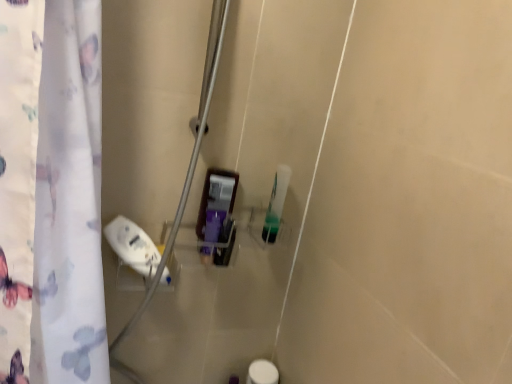
Question: Would you say translucent plastic container at center, the first toiletry viewed from the front, is to the left or to the right of green translucent bottle at center, the 2th toiletry from the left, in the picture?

Choices:
 (A) right
 (B) left

Answer: (B)

Question: From the image's perspective, is translucent plastic container at center, arranged as the 2th toiletry when viewed from the back, positioned above or below green translucent bottle at center, the 1th toiletry from the back?

Choices:
 (A) above
 (B) below

Answer: (B)

Question: In terms of width, does translucent plastic container at center, the first toiletry viewed from the front, look wider or thinner when compared to green translucent bottle at center, which is counted as the 1th toiletry, starting from the right?

Choices:
 (A) thin
 (B) wide

Answer: (B)

Question: Considering their positions, is green translucent bottle at center, which is counted as the 1th toiletry, starting from the right, located in front of or behind translucent plastic container at center, the 2th toiletry when ordered from right to left?

Choices:
 (A) behind
 (B) front

Answer: (A)

Question: From the image's perspective, is green translucent bottle at center, which is counted as the 1th toiletry, starting from the right, above or below translucent plastic container at center, the 2th toiletry when ordered from right to left?

Choices:
 (A) below
 (B) above

Answer: (B)

Question: Is point (x=287, y=170) closer or farther from the camera than point (x=206, y=240)?

Choices:
 (A) closer
 (B) farther

Answer: (B)

Question: Considering the positions of green translucent bottle at center, the 2th toiletry positioned from the front, and translucent plastic container at center, the first toiletry viewed from the front, in the image, is green translucent bottle at center, the 2th toiletry positioned from the front, taller or shorter than translucent plastic container at center, the first toiletry viewed from the front,?

Choices:
 (A) short
 (B) tall

Answer: (B)